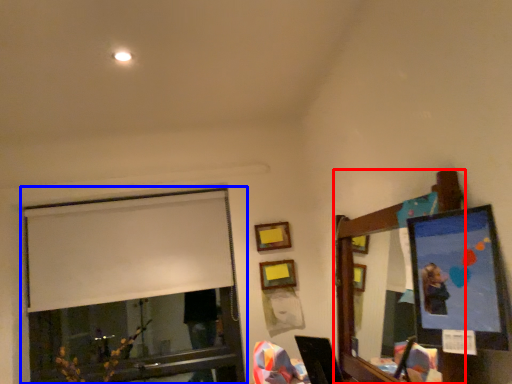
Question: Which point is further to the camera, mirror (highlighted by a red box) or window (highlighted by a blue box)?

Choices:
 (A) mirror
 (B) window

Answer: (B)